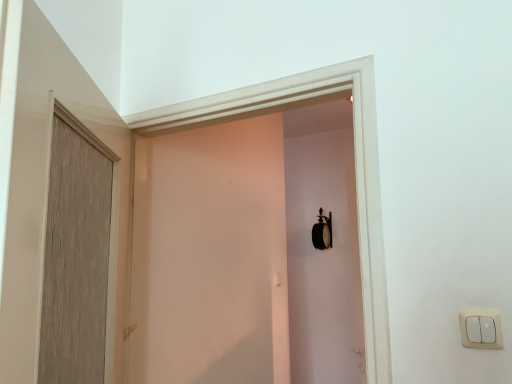
Question: Considering the relative positions of white plastic light switch at lower right and wooden door at left in the image provided, is white plastic light switch at lower right in front of wooden door at left?

Choices:
 (A) no
 (B) yes

Answer: (A)

Question: Does white plastic light switch at lower right have a lesser height compared to wooden door at left?

Choices:
 (A) no
 (B) yes

Answer: (B)

Question: Is white plastic light switch at lower right far from wooden door at left?

Choices:
 (A) yes
 (B) no

Answer: (B)

Question: Considering the relative sizes of white plastic light switch at lower right and wooden door at left in the image provided, is white plastic light switch at lower right thinner than wooden door at left?

Choices:
 (A) no
 (B) yes

Answer: (B)

Question: Does white plastic light switch at lower right turn towards wooden door at left?

Choices:
 (A) yes
 (B) no

Answer: (B)

Question: From a real-world perspective, is matte white screen door at center positioned above or below white plastic light switch at lower right?

Choices:
 (A) above
 (B) below

Answer: (A)

Question: From the image's perspective, is matte white screen door at center above or below white plastic light switch at lower right?

Choices:
 (A) above
 (B) below

Answer: (A)

Question: Is matte white screen door at center spatially inside white plastic light switch at lower right, or outside of it?

Choices:
 (A) outside
 (B) inside

Answer: (A)

Question: Is point (180, 213) closer or farther from the camera than point (487, 319)?

Choices:
 (A) farther
 (B) closer

Answer: (A)

Question: Based on their sizes in the image, would you say wooden door at left is bigger or smaller than white plastic light switch at lower right?

Choices:
 (A) small
 (B) big

Answer: (B)

Question: Looking at their shapes, would you say wooden door at left is wider or thinner than white plastic light switch at lower right?

Choices:
 (A) wide
 (B) thin

Answer: (A)

Question: Which is correct: wooden door at left is inside white plastic light switch at lower right, or outside of it?

Choices:
 (A) inside
 (B) outside

Answer: (B)

Question: From a real-world perspective, is wooden door at left physically located above or below white plastic light switch at lower right?

Choices:
 (A) below
 (B) above

Answer: (B)

Question: From a real-world perspective, relative to matte white screen door at center, is wooden door at left vertically above or below?

Choices:
 (A) above
 (B) below

Answer: (B)

Question: Is wooden door at left bigger or smaller than matte white screen door at center?

Choices:
 (A) small
 (B) big

Answer: (B)